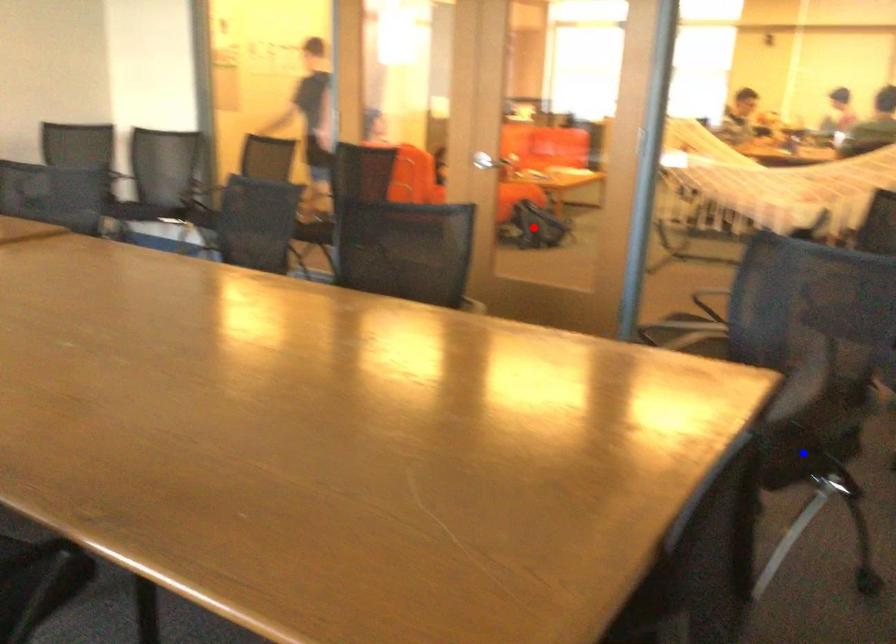
Question: Two points are marked on the image. Which point is closer to the camera?

Choices:
 (A) Blue point is closer.
 (B) Red point is closer.

Answer: (A)